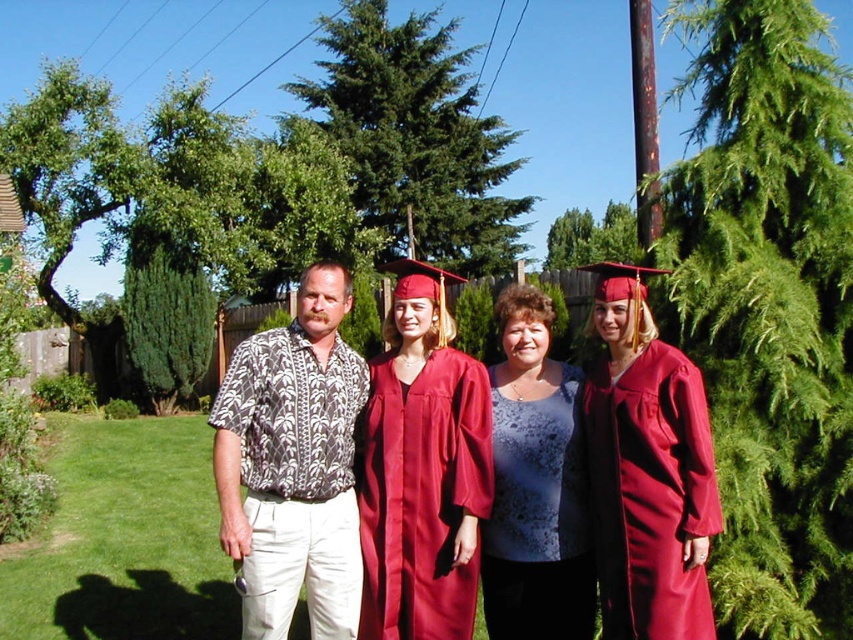
Question: Estimate the real-world distances between objects in this image. Which object is closer to the brown printed shirt at left?

Choices:
 (A) green leafy tree at upper right
 (B) maroon satin gown at center
 (C) green leafy tree at upper center

Answer: (B)

Question: In this image, where is matte red gown at center located relative to green leafy tree at upper center?

Choices:
 (A) below
 (B) above

Answer: (A)

Question: Is blue satin blouse at center to the left of matte red graduation gown at center from the viewer's perspective?

Choices:
 (A) yes
 (B) no

Answer: (B)

Question: Is maroon satin gown at center wider than matte red graduation gown at center?

Choices:
 (A) no
 (B) yes

Answer: (A)

Question: Which of these objects is positioned farthest from the blue satin blouse at center?

Choices:
 (A) green leafy tree at upper right
 (B) green leafy tree at upper center
 (C) matte red gown at center
 (D) maroon satin gown at center

Answer: (B)

Question: Among these objects, which one is nearest to the camera?

Choices:
 (A) matte red gown at center
 (B) green leafy tree at upper right
 (C) green leafy tree at upper center
 (D) maroon satin gown at center

Answer: (D)